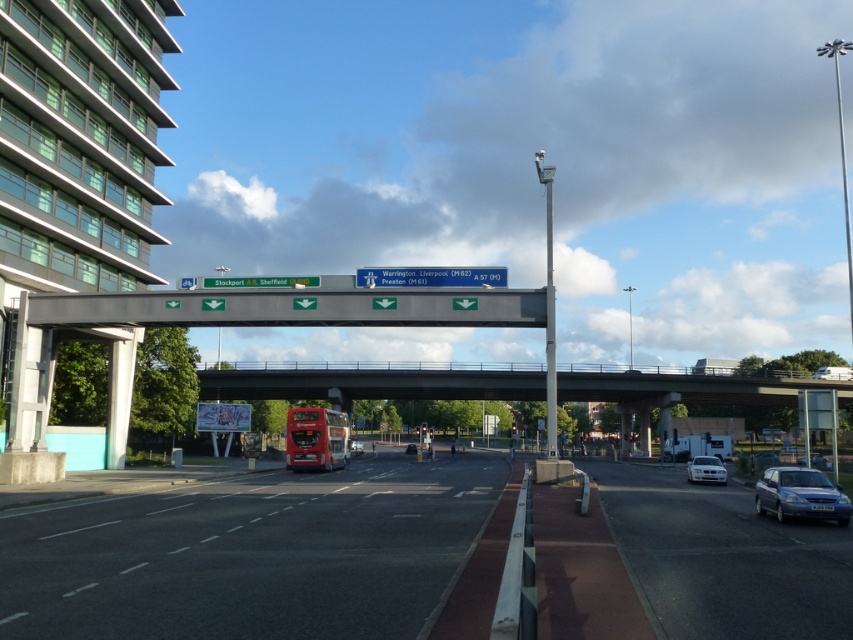
You are a driver approaching the overpass and see the metallic blue sedan at lower right and the blue plastic sign at center. Which object takes up more visual space in your view?

The blue plastic sign at center takes up more visual space than the metallic blue sedan at lower right because the description states that the sedan occupies less space than the sign.

You are a driver approaching the overpass and notice two points on the road ahead. The first point is at coordinate point (811, 504) and the second is at coordinate point (437, 269). Which point is closer to your current position as you drive towards the overpass?

Point (437, 269) is closer to your current position because it is behind point (811, 504), which is further ahead on the road.

You are a driver approaching the overpass and see the blue plastic sign at center and the metallic silver car at lower right. Which object is taller?

The blue plastic sign at center is much taller than the metallic silver car at lower right.